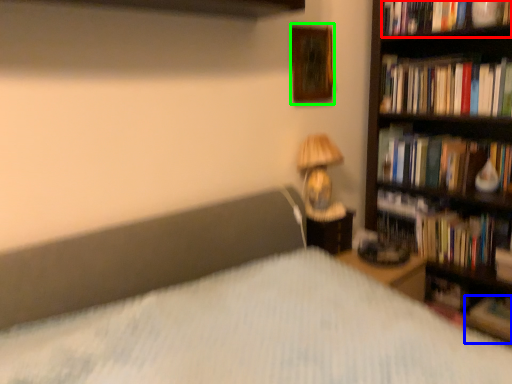
Question: Which object is positioned farthest from book (highlighted by a red box)? Select from book (highlighted by a blue box) and picture frame (highlighted by a green box).

Choices:
 (A) book
 (B) picture frame

Answer: (A)